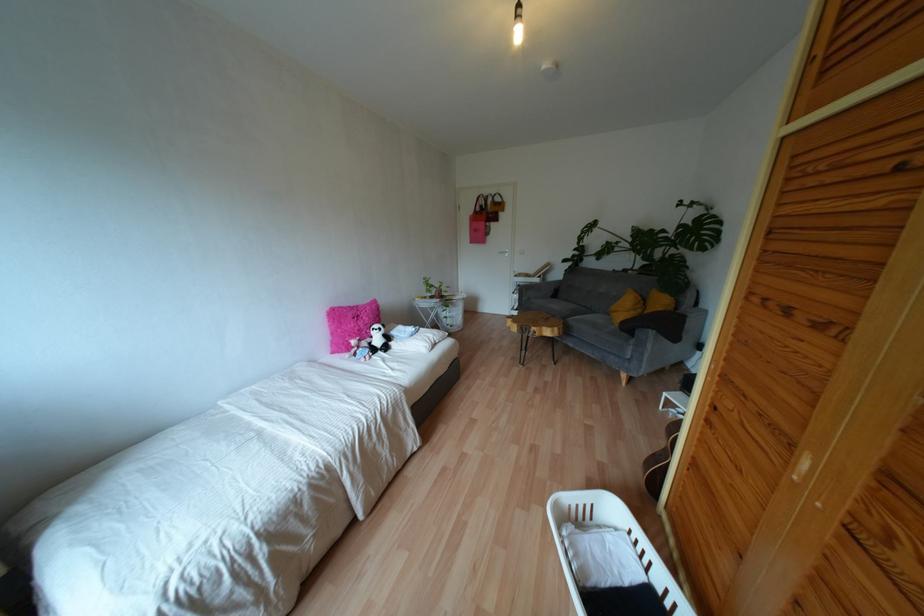
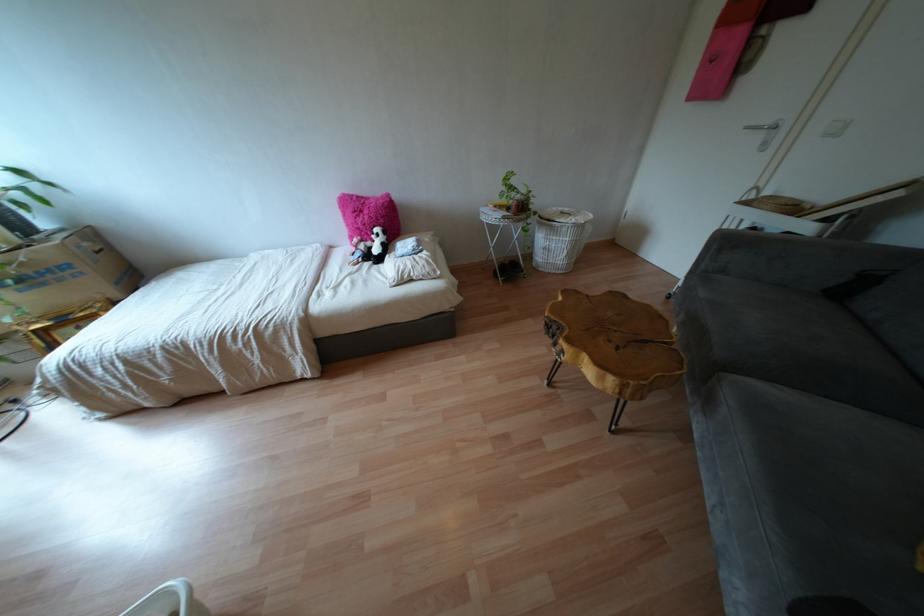
The point at (386, 337) is marked in the first image. Where is the corresponding point in the second image?

(385, 248)